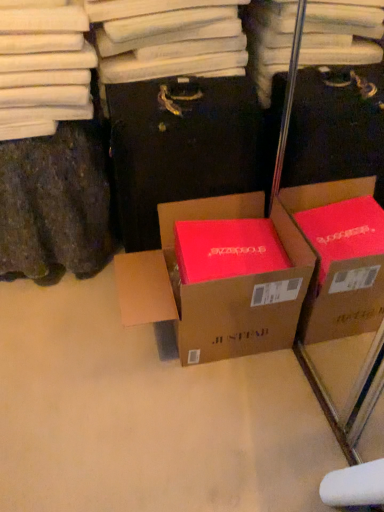
Question: From the image's perspective, would you say matte brown cardboard box at center is shown under matte cardboard box at center?

Choices:
 (A) no
 (B) yes

Answer: (A)

Question: Is matte brown cardboard box at center to the right of matte cardboard box at center from the viewer's perspective?

Choices:
 (A) no
 (B) yes

Answer: (A)

Question: Is matte brown cardboard box at center at the left side of matte cardboard box at center?

Choices:
 (A) yes
 (B) no

Answer: (A)

Question: Considering the relative sizes of matte brown cardboard box at center and matte cardboard box at center in the image provided, is matte brown cardboard box at center taller than matte cardboard box at center?

Choices:
 (A) no
 (B) yes

Answer: (B)

Question: Is matte brown cardboard box at center behind matte cardboard box at center?

Choices:
 (A) yes
 (B) no

Answer: (A)

Question: Is matte brown cardboard box at center surrounding matte cardboard box at center?

Choices:
 (A) no
 (B) yes

Answer: (A)

Question: Is matte cardboard box at center wider than matte brown cardboard box at center?

Choices:
 (A) no
 (B) yes

Answer: (B)

Question: Could matte brown cardboard box at center be considered to be inside matte cardboard box at center?

Choices:
 (A) no
 (B) yes

Answer: (A)

Question: Can you confirm if matte cardboard box at center is shorter than matte brown cardboard box at center?

Choices:
 (A) yes
 (B) no

Answer: (A)

Question: Is matte cardboard box at center in front of matte brown cardboard box at center?

Choices:
 (A) no
 (B) yes

Answer: (B)

Question: From the image's perspective, would you say matte cardboard box at center is shown under matte brown cardboard box at center?

Choices:
 (A) yes
 (B) no

Answer: (A)

Question: From a real-world perspective, is matte cardboard box at center beneath matte brown cardboard box at center?

Choices:
 (A) no
 (B) yes

Answer: (B)

Question: Is matte cardboard box at center in front of or behind matte brown cardboard box at center in the image?

Choices:
 (A) front
 (B) behind

Answer: (A)